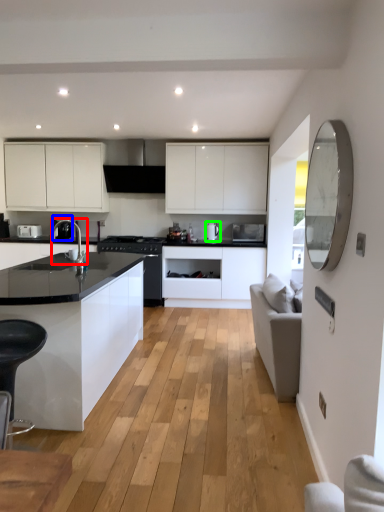
Question: Estimate the real-world distances between objects in this image. Which object is closer to sink (highlighted by a red box), coffee machine (highlighted by a blue box) or kitchen appliance (highlighted by a green box)?

Choices:
 (A) coffee machine
 (B) kitchen appliance

Answer: (A)